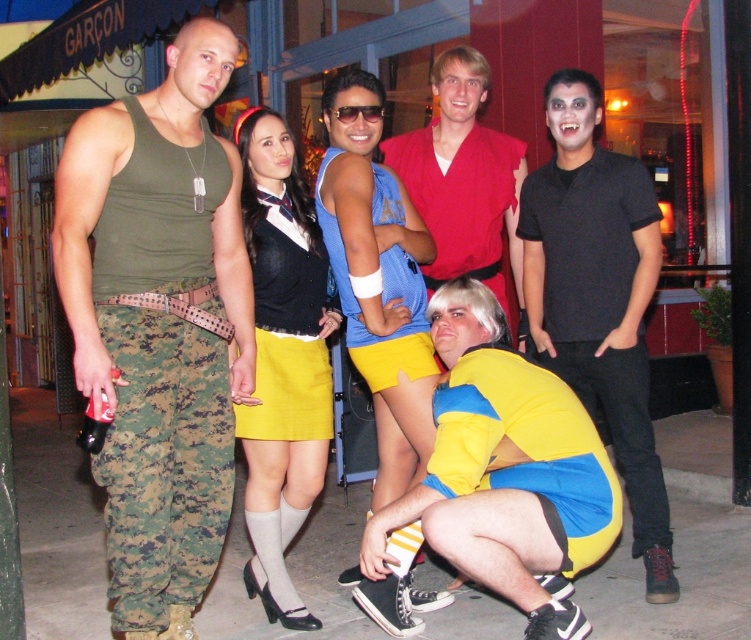
Can you confirm if black matte shirt at right is thinner than yellow fabric skirt at center?

In fact, black matte shirt at right might be wider than yellow fabric skirt at center.

Does point (644, 308) come closer to viewer compared to point (299, 310)?

That is False.

Locate an element on the screen. This screenshot has width=751, height=640. black matte shirt at right is located at coordinates (599, 296).

How much distance is there between black matte shirt at right and matte blue tank top at center?

A distance of 32.15 inches exists between black matte shirt at right and matte blue tank top at center.

The width and height of the screenshot is (751, 640). What do you see at coordinates (599, 296) in the screenshot? I see `black matte shirt at right` at bounding box center [599, 296].

Find the location of a particular element. The image size is (751, 640). black matte shirt at right is located at coordinates coord(599,296).

Is red velvet shirt at center bigger than yellow fabric skirt at center?

Indeed, red velvet shirt at center has a larger size compared to yellow fabric skirt at center.

Is red velvet shirt at center to the right of yellow fabric skirt at center from the viewer's perspective?

Indeed, red velvet shirt at center is positioned on the right side of yellow fabric skirt at center.

This screenshot has height=640, width=751. Describe the element at coordinates (463, 179) in the screenshot. I see `red velvet shirt at center` at that location.

The image size is (751, 640). Find the location of `red velvet shirt at center`. red velvet shirt at center is located at coordinates (463, 179).